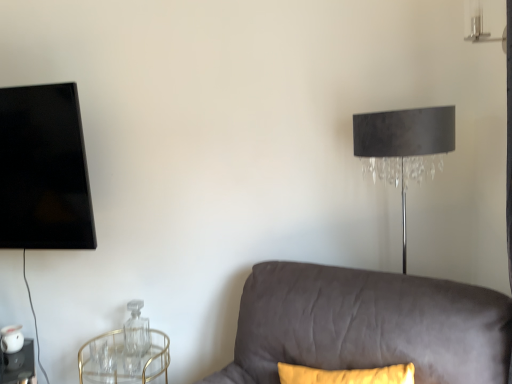
Question: From the image's perspective, is gold metallic round table at lower left under clear glass table at lower left?

Choices:
 (A) yes
 (B) no

Answer: (B)

Question: From a real-world perspective, is gold metallic round table at lower left below clear glass table at lower left?

Choices:
 (A) no
 (B) yes

Answer: (A)

Question: Is gold metallic round table at lower left to the left of clear glass table at lower left from the viewer's perspective?

Choices:
 (A) no
 (B) yes

Answer: (A)

Question: Is gold metallic round table at lower left taller than clear glass table at lower left?

Choices:
 (A) no
 (B) yes

Answer: (B)

Question: Is gold metallic round table at lower left oriented away from clear glass table at lower left?

Choices:
 (A) yes
 (B) no

Answer: (B)

Question: Does gold metallic round table at lower left have a smaller size compared to clear glass table at lower left?

Choices:
 (A) yes
 (B) no

Answer: (B)

Question: Can you confirm if matte black lampshade at upper right is positioned to the left of suede gray couch at lower right?

Choices:
 (A) yes
 (B) no

Answer: (B)

Question: From the image's perspective, would you say matte black lampshade at upper right is shown under suede gray couch at lower right?

Choices:
 (A) yes
 (B) no

Answer: (B)

Question: From a real-world perspective, is matte black lampshade at upper right on top of suede gray couch at lower right?

Choices:
 (A) yes
 (B) no

Answer: (A)

Question: Does matte black lampshade at upper right contain suede gray couch at lower right?

Choices:
 (A) yes
 (B) no

Answer: (B)

Question: Does matte black lampshade at upper right have a larger size compared to suede gray couch at lower right?

Choices:
 (A) no
 (B) yes

Answer: (A)

Question: From the image's perspective, is matte black lampshade at upper right above suede gray couch at lower right?

Choices:
 (A) yes
 (B) no

Answer: (A)

Question: From a real-world perspective, is clear glass table at lower left located beneath gold metallic round table at lower left?

Choices:
 (A) no
 (B) yes

Answer: (B)